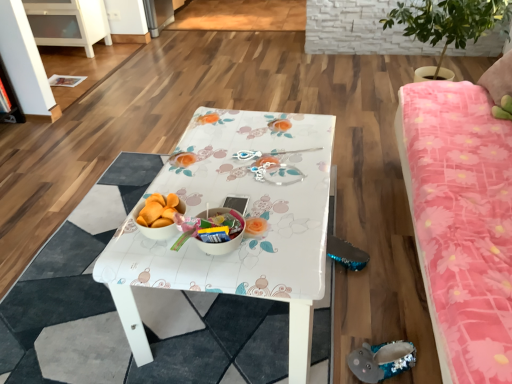
Where is `free region under sequined gray slipper at lower right (from a real-world perspective)`? free region under sequined gray slipper at lower right (from a real-world perspective) is located at coordinates (373, 366).